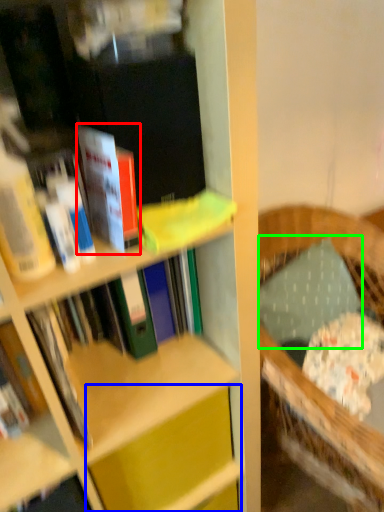
Question: Which object is the farthest from book (highlighted by a red box)? Choose among these: cabinet (highlighted by a blue box) or pillow (highlighted by a green box).

Choices:
 (A) cabinet
 (B) pillow

Answer: (B)